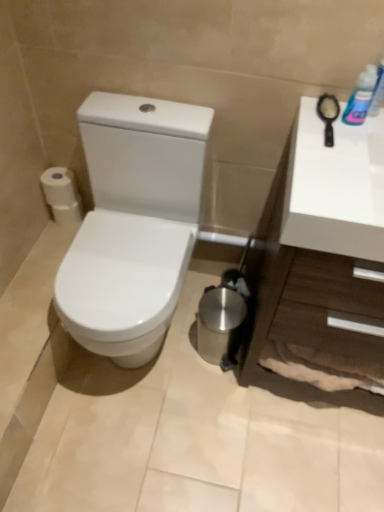
What do you see at coordinates (323, 259) in the screenshot? I see `white glossy countertop at right` at bounding box center [323, 259].

What is the approximate width of white glossy toilet at left?

25.29 inches.

Image resolution: width=384 pixels, height=512 pixels. What do you see at coordinates (133, 223) in the screenshot?
I see `white glossy toilet at left` at bounding box center [133, 223].

What do you see at coordinates (61, 195) in the screenshot? This screenshot has height=512, width=384. I see `white matte toilet paper at left` at bounding box center [61, 195].

Image resolution: width=384 pixels, height=512 pixels. In order to click on white matte toilet paper at left in this screenshot , I will do `click(61, 195)`.

This screenshot has width=384, height=512. In order to click on white glossy countertop at right in this screenshot , I will do `click(323, 259)`.

What's the angular difference between white glossy countertop at right and white matte toilet paper at left's facing directions?

The facing directions of white glossy countertop at right and white matte toilet paper at left are 3.62e-05 degrees apart.

Between white glossy countertop at right and white matte toilet paper at left, which one has more height?

Standing taller between the two is white glossy countertop at right.

From the image's perspective, between white glossy countertop at right and white matte toilet paper at left, who is located below?

white glossy countertop at right is shown below in the image.

Can we say white glossy countertop at right lies outside white matte toilet paper at left?

Indeed, white glossy countertop at right is completely outside white matte toilet paper at left.

Can you tell me how much blue plastic bottle at upper right and white matte toilet paper at left differ in facing direction?

blue plastic bottle at upper right and white matte toilet paper at left are facing 6.7e-05 degrees away from each other.

From a real-world perspective, is blue plastic bottle at upper right over white matte toilet paper at left?

Yes.

Who is smaller, blue plastic bottle at upper right or white matte toilet paper at left?

blue plastic bottle at upper right.

Between point (175, 281) and point (364, 72), which one is positioned in front?

The point (364, 72) is closer to the camera.

Which is behind, white glossy toilet at left or blue plastic bottle at upper right?

blue plastic bottle at upper right is behind.

Which of these two, white glossy toilet at left or blue plastic bottle at upper right, stands taller?

With more height is white glossy toilet at left.

From a real-world perspective, is white glossy toilet at left physically below white matte toilet paper at left?

Yes, from a real-world perspective, white glossy toilet at left is below white matte toilet paper at left.

Is white glossy toilet at left next to white matte toilet paper at left?

white glossy toilet at left and white matte toilet paper at left are clearly separated.

In terms of height, does white glossy toilet at left look taller or shorter compared to white matte toilet paper at left?

white glossy toilet at left is taller than white matte toilet paper at left.

From the image's perspective, is white glossy toilet at left under white matte toilet paper at left?

Correct, white glossy toilet at left appears lower than white matte toilet paper at left in the image.

Is blue plastic bottle at upper right bigger or smaller than white glossy toilet at left?

Considering their sizes, blue plastic bottle at upper right takes up less space than white glossy toilet at left.

How many degrees apart are the facing directions of blue plastic bottle at upper right and white glossy toilet at left?

The angular difference between blue plastic bottle at upper right and white glossy toilet at left is 5.66e-05 degrees.

Is point (366, 102) closer or farther from the camera than point (121, 123)?

Point (366, 102) is closer to the camera than point (121, 123).

Between blue plastic bottle at upper right and white glossy toilet at left, which one is positioned behind?

blue plastic bottle at upper right is further away from the camera.

From the image's perspective, does blue plastic bottle at upper right appear lower than white glossy countertop at right?

Actually, blue plastic bottle at upper right appears above white glossy countertop at right in the image.

Is blue plastic bottle at upper right oriented towards white glossy countertop at right?

No, blue plastic bottle at upper right is not facing towards white glossy countertop at right.

I want to click on counter top located on the right of blue plastic bottle at upper right, so click(323, 259).

Choose the correct answer: Is white glossy countertop at right inside blue plastic bottle at upper right or outside it?

The correct answer is: outside.

Considering the relative sizes of white glossy countertop at right and blue plastic bottle at upper right in the image provided, is white glossy countertop at right wider than blue plastic bottle at upper right?

Yes, white glossy countertop at right is wider than blue plastic bottle at upper right.

The image size is (384, 512). I want to click on mouthwash behind the white glossy countertop at right, so click(x=360, y=97).

Could you tell me if white glossy countertop at right is turned towards blue plastic bottle at upper right?

No, white glossy countertop at right is not oriented towards blue plastic bottle at upper right.

Locate an element on the screen. counter top below the white matte toilet paper at left (from the image's perspective) is located at coordinates (323, 259).

This screenshot has height=512, width=384. What are the coordinates of `toilet paper that is behind the blue plastic bottle at upper right` in the screenshot? It's located at (61, 195).

Considering their positions, is white glossy countertop at right positioned closer to white glossy toilet at left than blue plastic bottle at upper right?

Based on the image, white glossy countertop at right appears to be nearer to white glossy toilet at left.

Estimate the real-world distances between objects in this image. Which object is closer to blue plastic bottle at upper right, white matte toilet paper at left or white glossy countertop at right?

white glossy countertop at right is closer to blue plastic bottle at upper right.

Considering their positions, is white glossy toilet at left positioned further to white matte toilet paper at left than blue plastic bottle at upper right?

Among the two, blue plastic bottle at upper right is located further to white matte toilet paper at left.

Estimate the real-world distances between objects in this image. Which object is closer to white glossy countertop at right, blue plastic bottle at upper right or white glossy toilet at left?

The object closer to white glossy countertop at right is blue plastic bottle at upper right.

Looking at the image, which one is located further to white glossy toilet at left, blue plastic bottle at upper right or white matte toilet paper at left?

blue plastic bottle at upper right is positioned further to the anchor white glossy toilet at left.

From the picture: Which object lies further to the anchor point blue plastic bottle at upper right, white glossy toilet at left or white glossy countertop at right?

The object further to blue plastic bottle at upper right is white glossy toilet at left.

From the image, which object appears to be nearer to white glossy toilet at left, white matte toilet paper at left or blue plastic bottle at upper right?

white matte toilet paper at left is closer to white glossy toilet at left.

Based on their spatial positions, is white glossy toilet at left or white matte toilet paper at left closer to blue plastic bottle at upper right?

white glossy toilet at left lies closer to blue plastic bottle at upper right than the other object.

Locate an element on the screen. This screenshot has width=384, height=512. toilet located between white matte toilet paper at left and white glossy countertop at right in the left-right direction is located at coordinates (133, 223).

This screenshot has width=384, height=512. What are the coordinates of `mouthwash between white glossy toilet at left and white glossy countertop at right in the horizontal direction` in the screenshot? It's located at (360, 97).

Identify the location of mouthwash between white matte toilet paper at left and white glossy countertop at right. Image resolution: width=384 pixels, height=512 pixels. (360, 97).

Locate an element on the screen. The height and width of the screenshot is (512, 384). toilet located between white matte toilet paper at left and blue plastic bottle at upper right in the left-right direction is located at coordinates (133, 223).